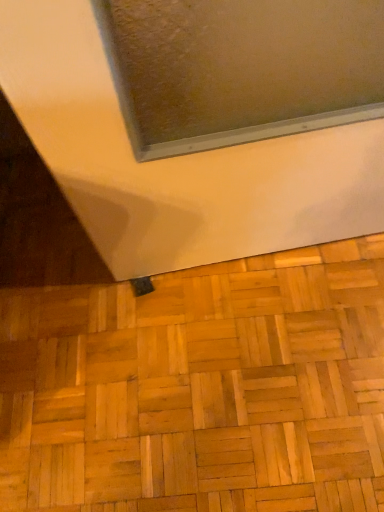
The width and height of the screenshot is (384, 512). Identify the location of empty space that is ontop of natural wood parquet floor at lower center (from a real-world perspective). click(x=179, y=342).